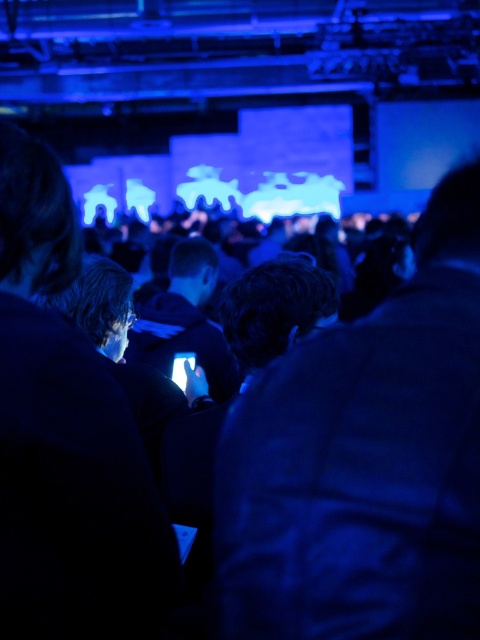
You are organizing a photo shoot and need to place a 18 inch wide prop between the dark blue leather jacket at center and the matte black laptop at left. Based on their widths, will the prop fit between them?

The dark blue leather jacket at center is wider than the matte black laptop at left. Since the prop is 18 inches wide, it depends on the actual distance between them. However, the description only states the jacket is wider, not the exact space. Without knowing the exact gap, we can only confirm the jacket is wider but cannot determine if the prop will fit.

From the picture: You are an attendee at this event and want to borrow a laptop charger from someone. You see the dark blue leather jacket at center and the matte black laptop at left. Which object is closer to your left side?

The matte black laptop at left is closer to your left side since it is positioned to the left of the dark blue leather jacket at center.